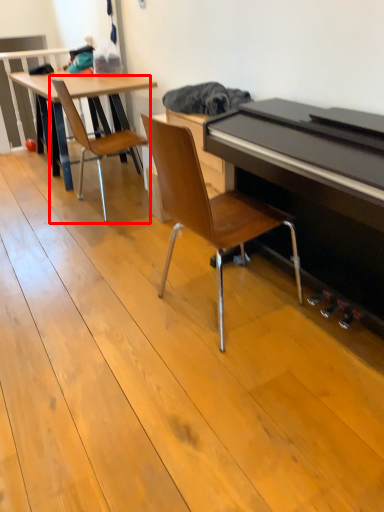
Question: In this image, where is chair (annotated by the red box) located relative to chair?

Choices:
 (A) right
 (B) left

Answer: (B)